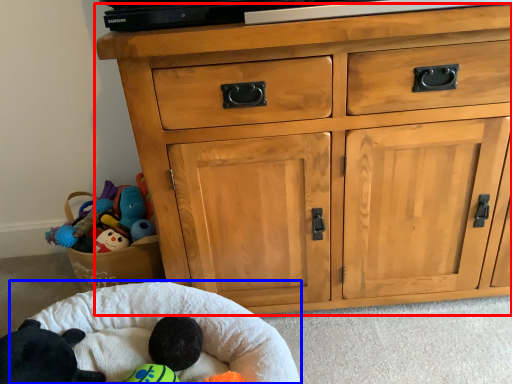
Question: Which of the following is the farthest to the observer, chest of drawers (highlighted by a red box) or infant bed (highlighted by a blue box)?

Choices:
 (A) chest of drawers
 (B) infant bed

Answer: (A)